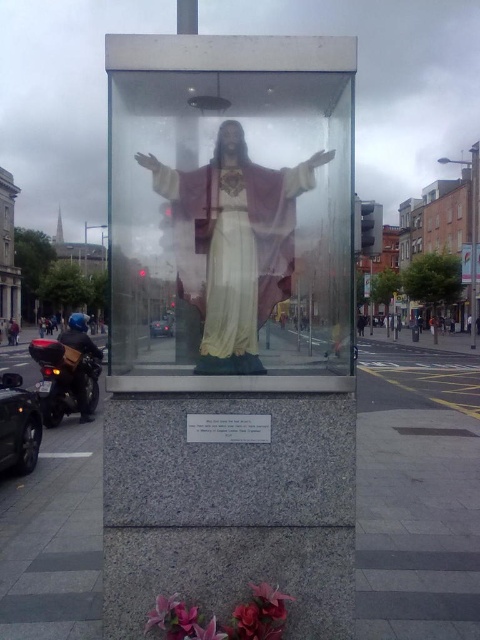
You are a delivery person trying to park your shiny black motorcycle at lower left near the matte gold statue at center. Considering the statue is in the way, can you maneuver your motorcycle to park next to it without hitting the statue?

The matte gold statue at center is thinner than the shiny black motorcycle at lower left, so there might not be enough space to park the motorcycle next to the statue without risking a collision. You should look for another parking spot.

Looking at this image, you are a pedestrian standing in front of the sculpture and want to reach the red leather jacket at lower left without stepping on the shiny black motorcycle at lower left. Can you walk around the motorcycle to get to the jacket?

The shiny black motorcycle at lower left is closer to the viewer than the red leather jacket at lower left, so you can walk around the motorcycle to reach the jacket since it is in front of the jacket.